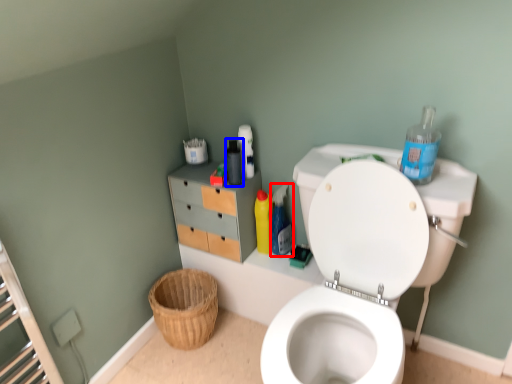
Question: Which object appears closest to the camera in this image, cleaning product (highlighted by a red box) or bottle (highlighted by a blue box)?

Choices:
 (A) cleaning product
 (B) bottle

Answer: (B)